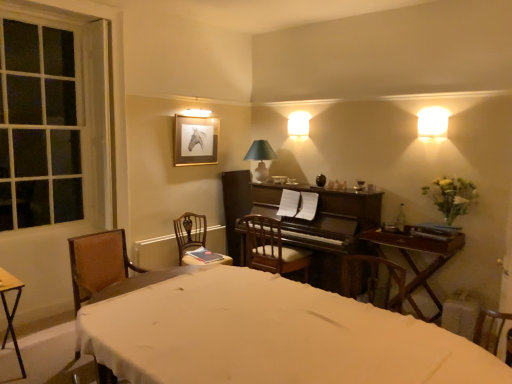
Question: Can you confirm if dark wood piano at center is taller than wooden chair with cushion at center, the 3th chair when ordered from left to right?

Choices:
 (A) yes
 (B) no

Answer: (A)

Question: Is the depth of dark wood piano at center less than that of wooden chair with cushion at center, the 3th chair when ordered from left to right?

Choices:
 (A) no
 (B) yes

Answer: (B)

Question: Could you tell me if dark wood piano at center is facing wooden chair with cushion at center, acting as the 1th chair starting from the right?

Choices:
 (A) yes
 (B) no

Answer: (A)

Question: Can we say dark wood piano at center lies outside wooden chair with cushion at center, acting as the 1th chair starting from the right?

Choices:
 (A) no
 (B) yes

Answer: (B)

Question: Is dark wood piano at center smaller than wooden chair with cushion at center, the 3th chair when ordered from left to right?

Choices:
 (A) yes
 (B) no

Answer: (B)

Question: Considering their positions, is clear glass window at left located in front of or behind wooden chair with cushion at center, the 3th chair when ordered from left to right?

Choices:
 (A) front
 (B) behind

Answer: (A)

Question: Choose the correct answer: Is clear glass window at left inside wooden chair with cushion at center, the 3th chair when ordered from left to right, or outside it?

Choices:
 (A) outside
 (B) inside

Answer: (A)

Question: From the image's perspective, is clear glass window at left above or below wooden chair with cushion at center, the 3th chair when ordered from left to right?

Choices:
 (A) below
 (B) above

Answer: (B)

Question: In the image, is clear glass window at left on the left side or the right side of wooden chair with cushion at center, the 3th chair when ordered from left to right?

Choices:
 (A) left
 (B) right

Answer: (A)

Question: From the image's perspective, is brown wooden chair at center, placed as the 2th chair when sorted from left to right, located above or below white fabric bed at lower left?

Choices:
 (A) above
 (B) below

Answer: (A)

Question: From a real-world perspective, is brown wooden chair at center, arranged as the 2th chair when viewed from the right, above or below white fabric bed at lower left?

Choices:
 (A) above
 (B) below

Answer: (A)

Question: Considering the positions of brown wooden chair at center, placed as the 2th chair when sorted from left to right, and white fabric bed at lower left in the image, is brown wooden chair at center, placed as the 2th chair when sorted from left to right, wider or thinner than white fabric bed at lower left?

Choices:
 (A) thin
 (B) wide

Answer: (A)

Question: Would you say brown wooden chair at center, arranged as the 2th chair when viewed from the right, is inside or outside white fabric bed at lower left?

Choices:
 (A) inside
 (B) outside

Answer: (B)

Question: From the image's perspective, relative to gold-framed horse portrait at upper center, is green fabric lampshade at upper center, positioned as the 2th lamp in right-to-left order, above or below?

Choices:
 (A) below
 (B) above

Answer: (A)

Question: Considering the positions of green fabric lampshade at upper center, the 2th lamp in the top-to-bottom sequence, and gold-framed horse portrait at upper center in the image, is green fabric lampshade at upper center, the 2th lamp in the top-to-bottom sequence, taller or shorter than gold-framed horse portrait at upper center?

Choices:
 (A) tall
 (B) short

Answer: (B)